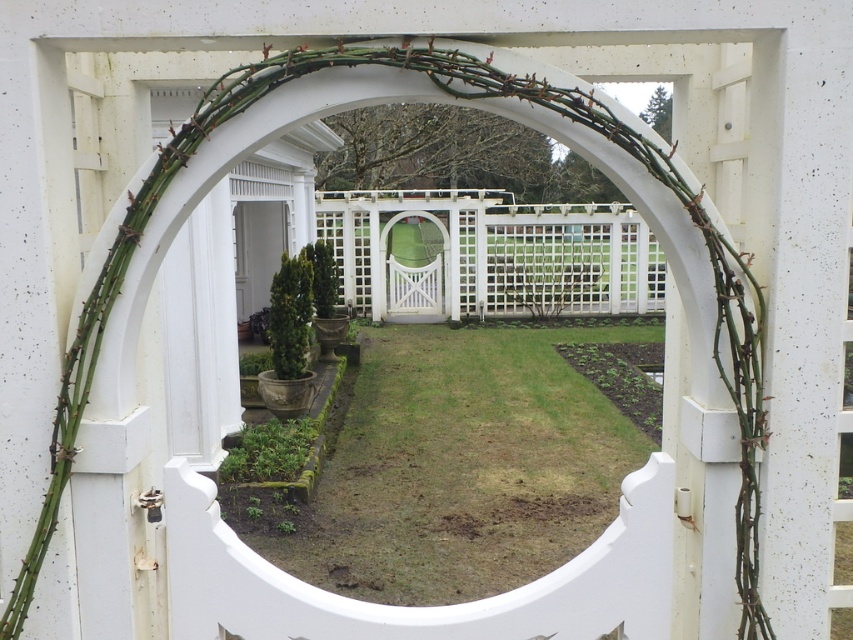
Question: Among these objects, which one is nearest to the camera?

Choices:
 (A) white glossy door at center
 (B) white lattice fence at center

Answer: (A)

Question: Is white lattice fence at center above white glossy door at center?

Choices:
 (A) yes
 (B) no

Answer: (B)

Question: Which of the following is the farthest from the observer?

Choices:
 (A) (502, 301)
 (B) (248, 212)

Answer: (A)

Question: Which point is closer to the camera?

Choices:
 (A) white glossy door at center
 (B) white lattice fence at center

Answer: (A)

Question: Considering the relative positions of white lattice fence at center and white glossy door at center in the image provided, where is white lattice fence at center located with respect to white glossy door at center?

Choices:
 (A) right
 (B) left

Answer: (A)

Question: Can you confirm if white lattice fence at center is bigger than white glossy door at center?

Choices:
 (A) yes
 (B) no

Answer: (A)